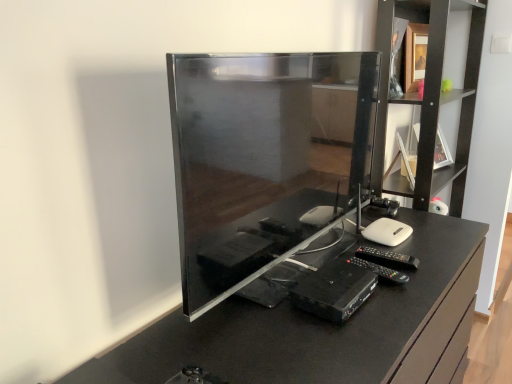
Question: Can you confirm if matte black desktop computer at center is bigger than glossy black tv at center?

Choices:
 (A) no
 (B) yes

Answer: (A)

Question: From the image's perspective, does matte black desktop computer at center appear higher than glossy black tv at center?

Choices:
 (A) no
 (B) yes

Answer: (B)

Question: Is matte black desktop computer at center aimed at glossy black tv at center?

Choices:
 (A) no
 (B) yes

Answer: (A)

Question: Is matte black desktop computer at center further to camera compared to glossy black tv at center?

Choices:
 (A) no
 (B) yes

Answer: (B)

Question: Is glossy black tv at center inside matte black desktop computer at center?

Choices:
 (A) yes
 (B) no

Answer: (B)

Question: Considering the positions of black plastic dvd player at center and black wood shelf at upper right in the image, is black plastic dvd player at center taller or shorter than black wood shelf at upper right?

Choices:
 (A) tall
 (B) short

Answer: (B)

Question: Is black plastic dvd player at center to the left or to the right of black wood shelf at upper right in the image?

Choices:
 (A) right
 (B) left

Answer: (B)

Question: Considering the positions of black plastic dvd player at center and black wood shelf at upper right in the image, is black plastic dvd player at center bigger or smaller than black wood shelf at upper right?

Choices:
 (A) small
 (B) big

Answer: (A)

Question: Is black plastic dvd player at center inside or outside of black wood shelf at upper right?

Choices:
 (A) outside
 (B) inside

Answer: (A)

Question: Is glossy black tv at center situated inside black plastic dvd player at center or outside?

Choices:
 (A) inside
 (B) outside

Answer: (B)

Question: In the image, is glossy black tv at center positioned in front of or behind black plastic dvd player at center?

Choices:
 (A) front
 (B) behind

Answer: (A)

Question: From the image's perspective, is glossy black tv at center located above or below black plastic dvd player at center?

Choices:
 (A) below
 (B) above

Answer: (A)

Question: Is point (371, 369) closer or farther from the camera than point (323, 317)?

Choices:
 (A) farther
 (B) closer

Answer: (B)

Question: Considering the positions of black wood shelf at upper right and glossy black tv at center in the image, is black wood shelf at upper right taller or shorter than glossy black tv at center?

Choices:
 (A) tall
 (B) short

Answer: (A)

Question: Is point 378,180 positioned closer to the camera than point 437,347?

Choices:
 (A) farther
 (B) closer

Answer: (A)